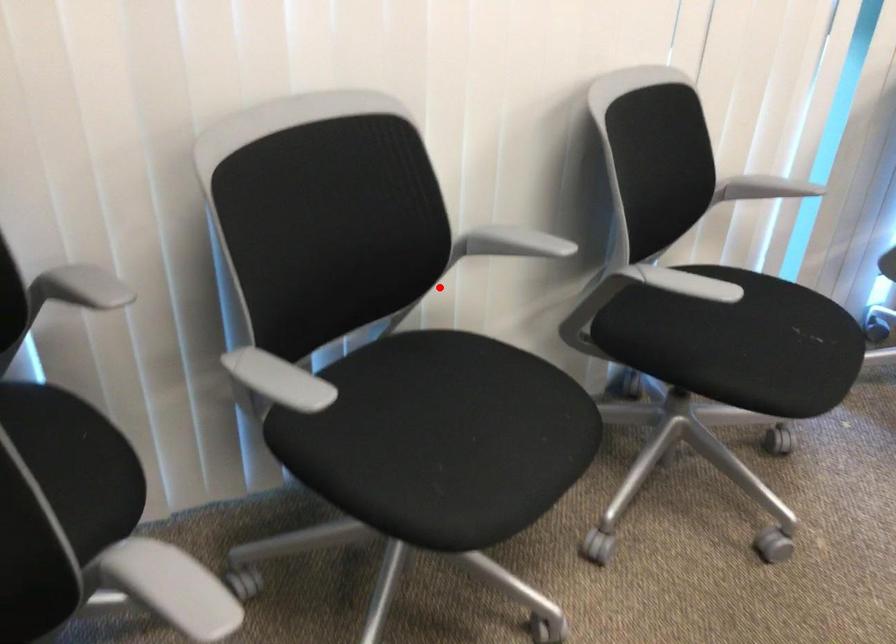
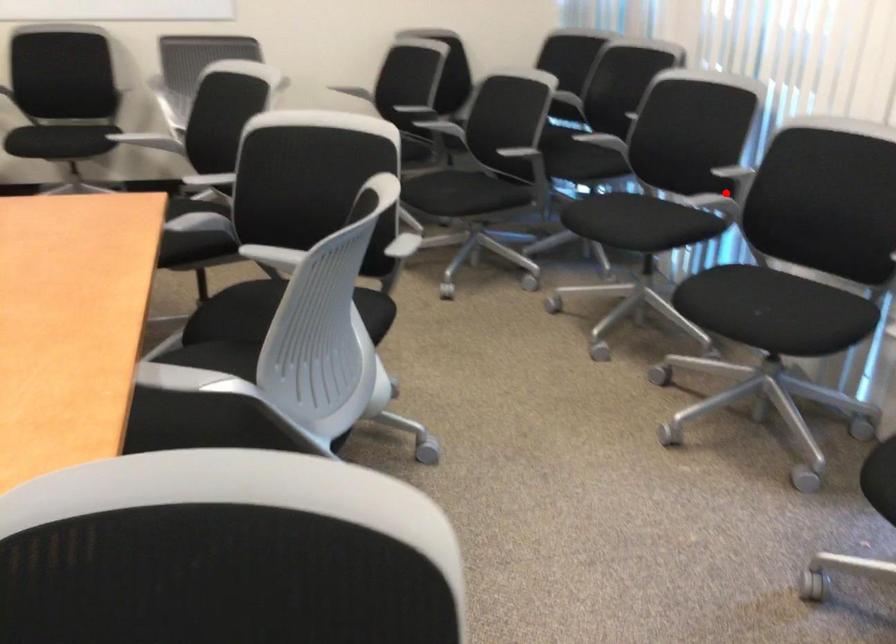
I am providing you with two images of the same scene from different viewpoints. A red point is marked on the first image and another point is marked on the second image. Is the red point in image1 aligned with the point shown in image2?

Yes